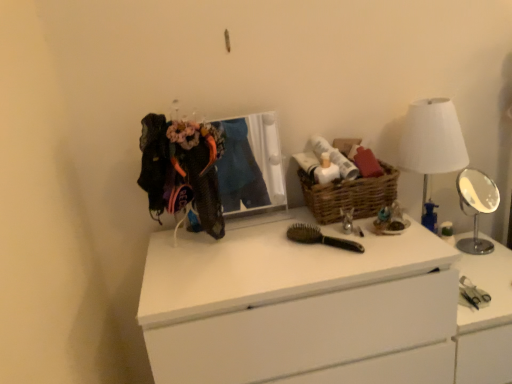
This screenshot has width=512, height=384. In order to click on vacant area that is in front of knitted fabric clothesline at upper left in this screenshot , I will do `click(198, 264)`.